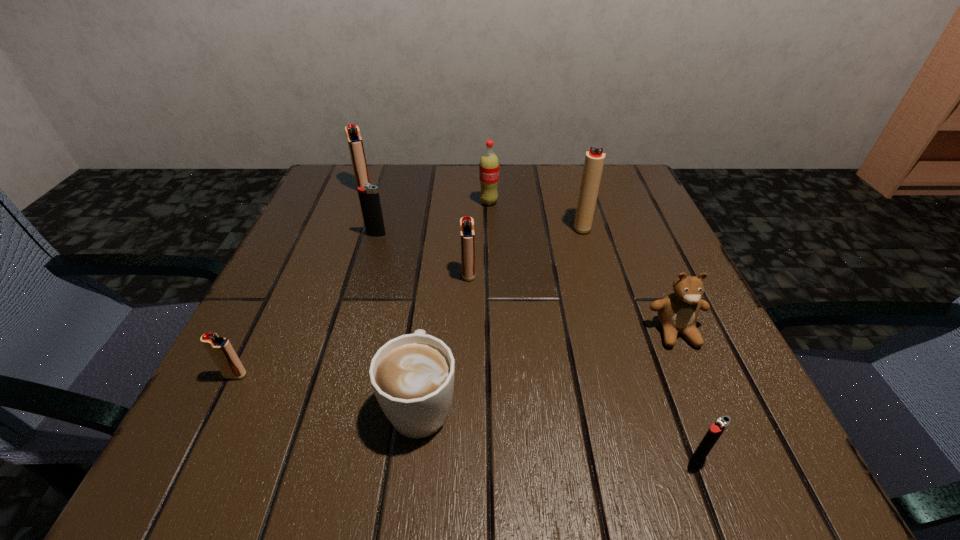
Where is `the fourth nearest object`? This screenshot has height=540, width=960. the fourth nearest object is located at coordinates (678, 312).

Locate an element on the screen. This screenshot has width=960, height=540. cappuccino is located at coordinates (412, 376).

Find the location of a particular element. the leftmost igniter is located at coordinates (221, 351).

Where is `the leftmost object`? This screenshot has width=960, height=540. the leftmost object is located at coordinates (221, 351).

You are a GUI agent. You are given a task and a screenshot of the screen. Output one action in this format:
    pyautogui.click(x=<x>, y=<y>)
    Task: Click on the right black igniter
    
    Given the screenshot: What is the action you would take?
    pyautogui.click(x=715, y=431)

Identify the location of the nearer black igniter. This screenshot has width=960, height=540. (715, 431).

Find the location of a particular element. vacant point located on the left of the tallest igniter is located at coordinates (450, 226).

I want to click on vacant space situated on the right of the fifth igniter from right to left, so coord(414,187).

This screenshot has height=540, width=960. In order to click on vacant space located 0.050m on the left of the soda in this screenshot , I will do `click(457, 202)`.

You are a GUI agent. You are given a task and a screenshot of the screen. Output one action in this format:
    pyautogui.click(x=<x>, y=<y>)
    Task: Click on the free space located on the left of the farther black igniter
    
    Given the screenshot: What is the action you would take?
    pyautogui.click(x=308, y=235)